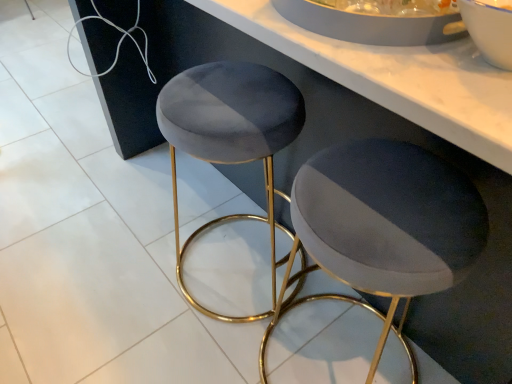
Find the location of a particular element. The width and height of the screenshot is (512, 384). vacant region under velvet grey stool at center (from a real-world perspective) is located at coordinates (328, 338).